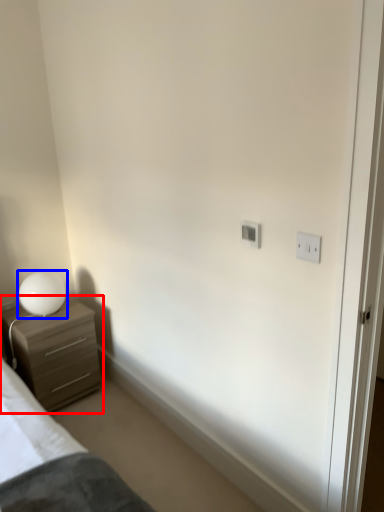
Question: Which point is closer to the camera, chest of drawers (highlighted by a red box) or table lamp (highlighted by a blue box)?

Choices:
 (A) chest of drawers
 (B) table lamp

Answer: (A)